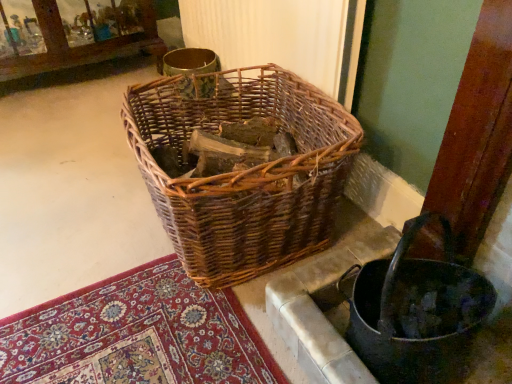
Locate an element on the screen. The height and width of the screenshot is (384, 512). free spot in front of woven brown basket at center is located at coordinates (172, 335).